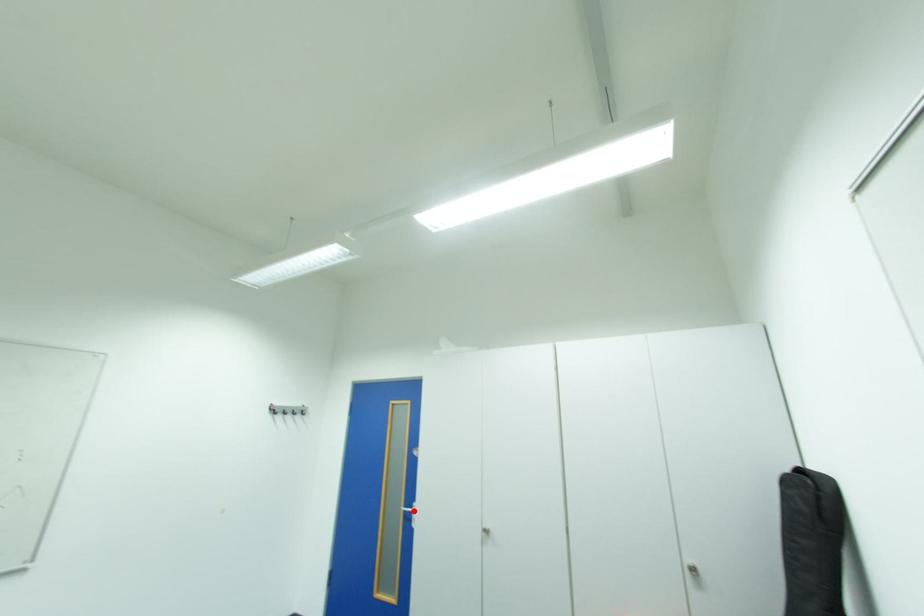
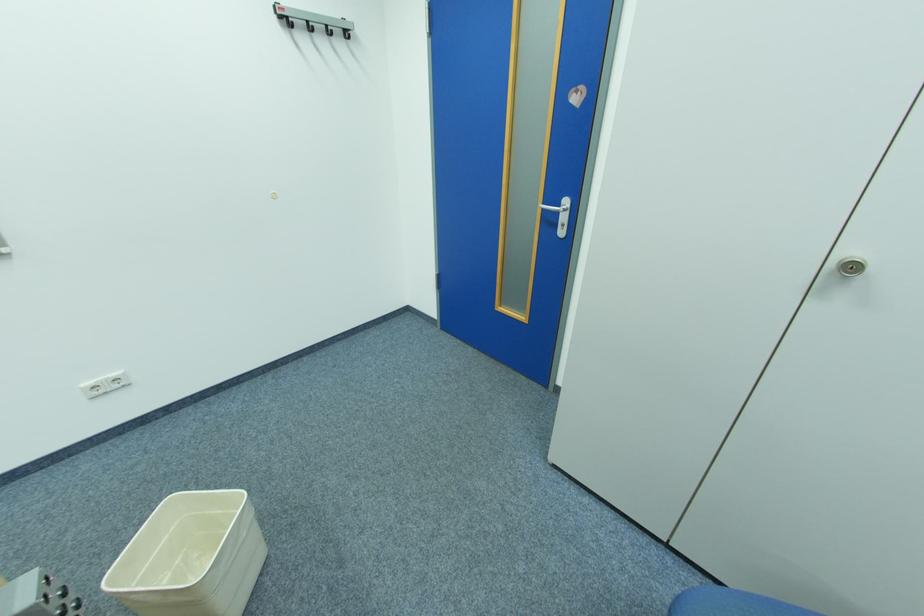
The point at the highlighted location is marked in the first image. Where is the corresponding point in the second image?

(552, 209)